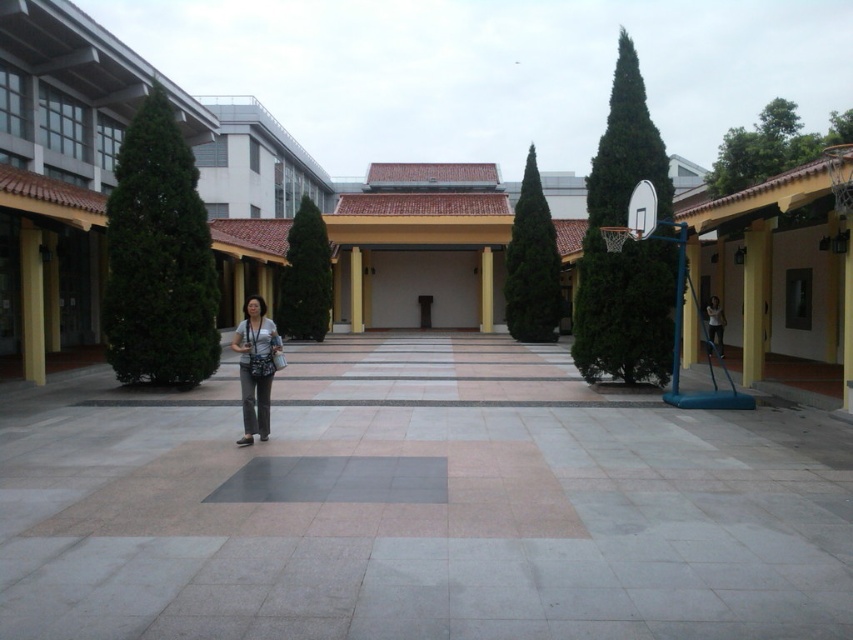
Question: Does matte black camera at center appear on the right side of yellow matte pillar at center?

Choices:
 (A) no
 (B) yes

Answer: (A)

Question: From the image, what is the correct spatial relationship of matte black camera at center in relation to yellow matte pillar at right?

Choices:
 (A) left
 (B) right

Answer: (A)

Question: Which of the following is the farthest from the observer?

Choices:
 (A) yellow matte pillar at left
 (B) matte black camera at center
 (C) white glossy pillar at center
 (D) yellow matte pillar at right

Answer: (C)

Question: Does gray concrete courtyard at center appear on the right side of yellow matte pillar at right?

Choices:
 (A) yes
 (B) no

Answer: (B)

Question: Considering the real-world distances, which object is closest to the yellow matte pillar at left?

Choices:
 (A) yellow matte pillar at right
 (B) gray concrete courtyard at center

Answer: (B)

Question: Which object is closer to the camera taking this photo?

Choices:
 (A) yellow matte pillar at center
 (B) white glossy pillar at center
 (C) yellow matte pillar at left

Answer: (C)